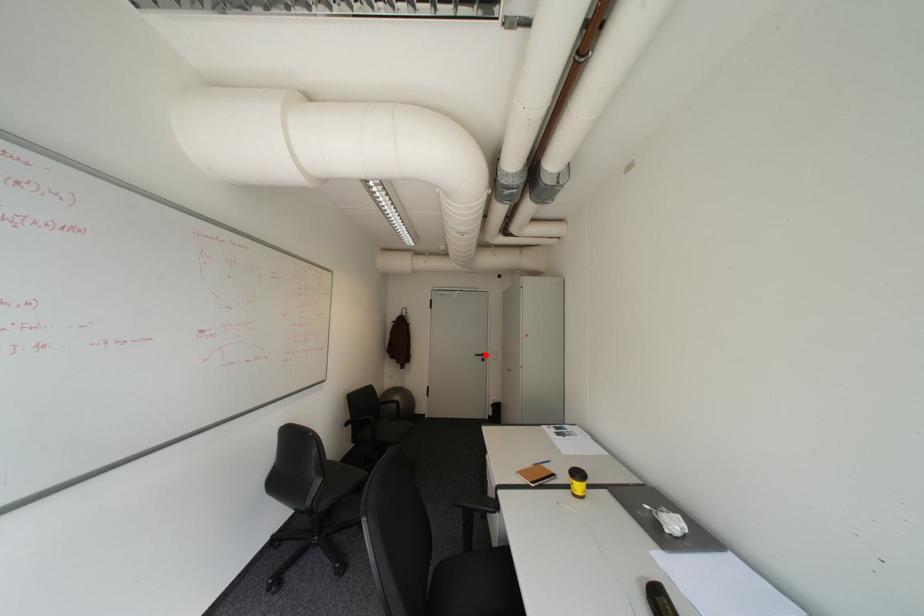
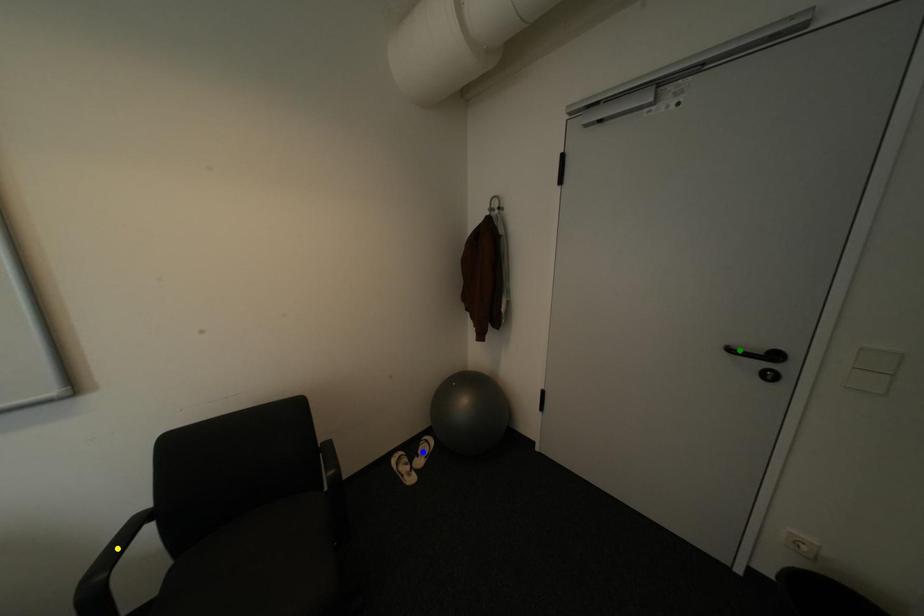
Question: I am providing you with two images of the same scene from different viewpoints. A red point is marked on the first image. You are given multiple points on the second image. Which point in image 2 represents the same 3d spot as the red point in image 1?

Choices:
 (A) blue point
 (B) green point
 (C) yellow point

Answer: (B)